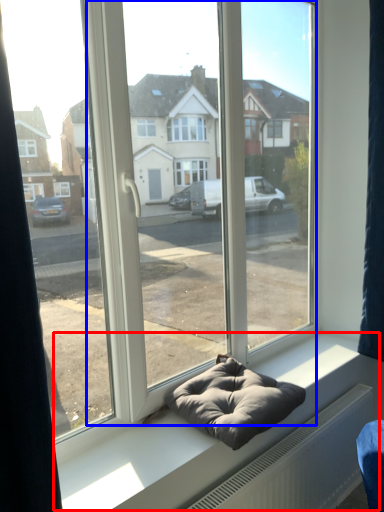
Question: Which object is further to the camera taking this photo, window sill (highlighted by a red box) or glass door (highlighted by a blue box)?

Choices:
 (A) window sill
 (B) glass door

Answer: (A)